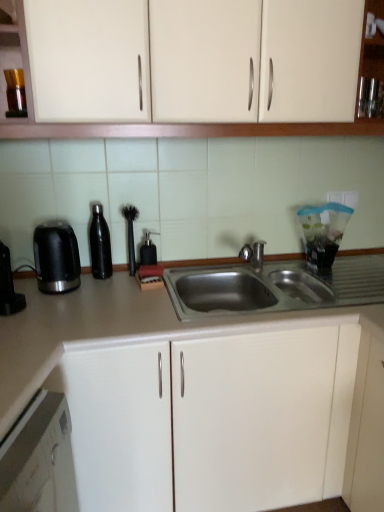
This screenshot has width=384, height=512. Identify the location of vacant area located to the right-hand side of black plastic coffee machine at left. (57, 311).